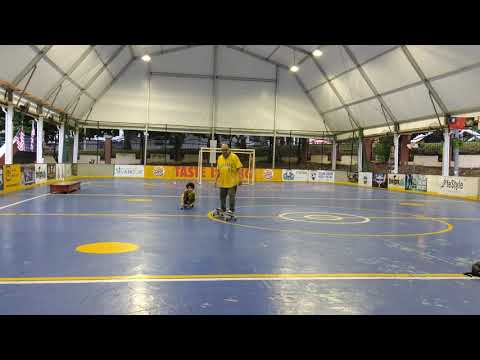
Find the location of a particular element. This screenshot has height=360, width=480. floor is located at coordinates pos(272,255).